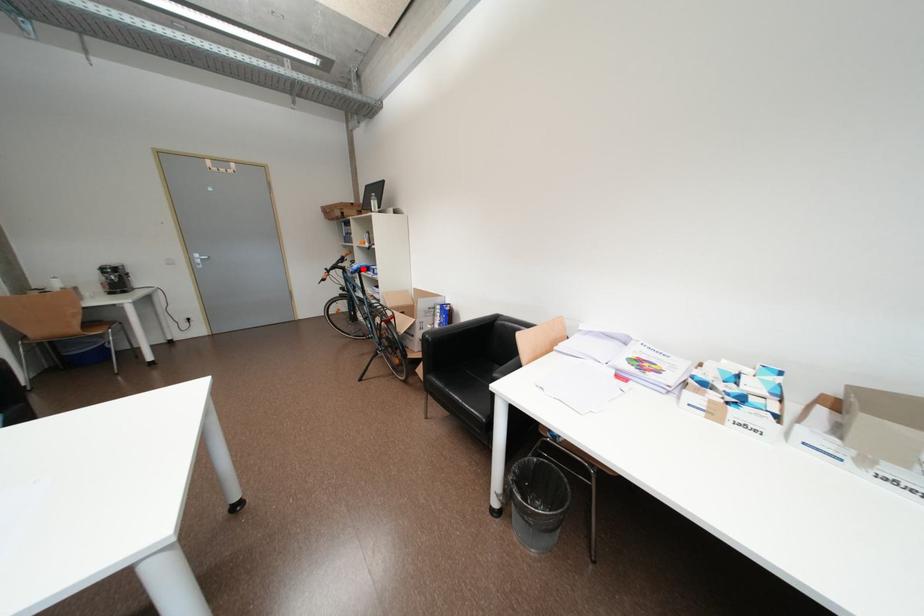
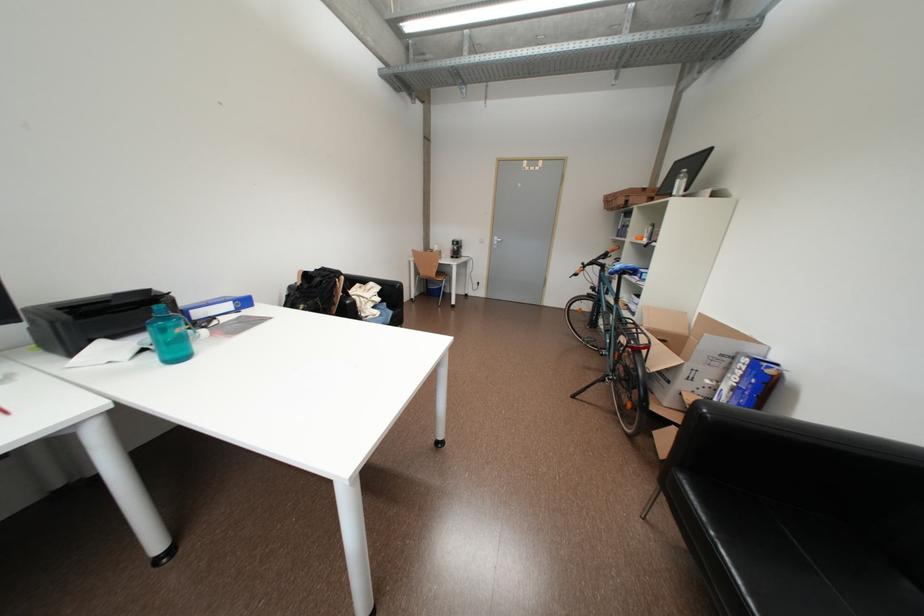
Question: I am providing you with two images of the same scene from different viewpoints. Image1 has a red point marked. In image2, the corresponding 3D location appears at what relative position? Reply with the corresponding letter.

Choices:
 (A) Closer
 (B) Farther

Answer: (B)